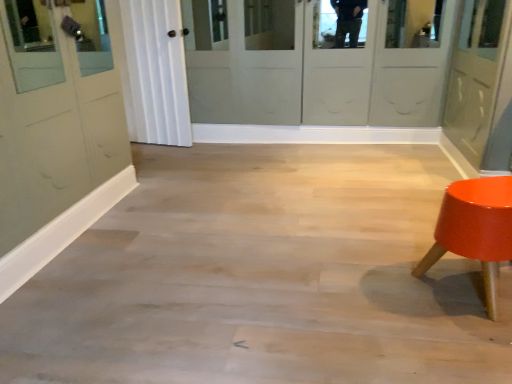
Where is `free space behind shiny orange stool at right`? free space behind shiny orange stool at right is located at coordinates (392, 236).